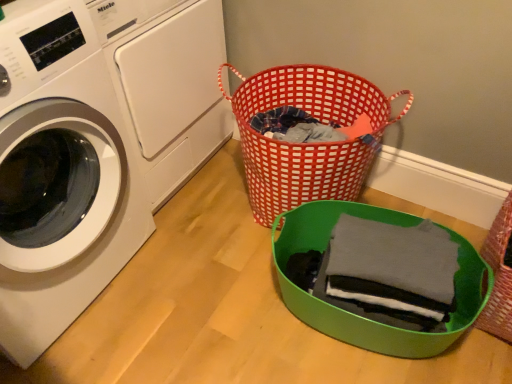
Question: Choose the correct answer: Is white glossy washing machine at upper left, which ranks as the second washing machine in front-to-back order, inside red woven basket at center, placed as the 3th basket when sorted from right to left, or outside it?

Choices:
 (A) outside
 (B) inside

Answer: (A)

Question: Considering the relative positions of white glossy washing machine at upper left, arranged as the first washing machine when viewed from the back, and red woven basket at center, placed as the first basket when sorted from left to right, in the image provided, is white glossy washing machine at upper left, arranged as the first washing machine when viewed from the back, to the left or to the right of red woven basket at center, placed as the first basket when sorted from left to right,?

Choices:
 (A) left
 (B) right

Answer: (A)

Question: Which object is the closest to the white glossy washing machine at upper left, arranged as the first washing machine when viewed from the back?

Choices:
 (A) rustic woven basket at lower right, the 1th basket viewed from the right
 (B) green plastic basket at lower right, positioned as the second basket in right-to-left order
 (C) dark gray cotton shirt at center
 (D) red woven basket at center, placed as the first basket when sorted from left to right
 (E) white glossy washing machine at left, which appears as the second washing machine when viewed from the back

Answer: (E)

Question: Estimate the real-world distances between objects in this image. Which object is farther from the green plastic basket at lower right, the second basket in the left-to-right sequence?

Choices:
 (A) red woven basket at center, placed as the first basket when sorted from left to right
 (B) white glossy washing machine at upper left, arranged as the first washing machine when viewed from the back
 (C) white glossy washing machine at left, which appears as the second washing machine when viewed from the back
 (D) dark gray cotton shirt at center
 (E) rustic woven basket at lower right, the third basket positioned from the left

Answer: (C)